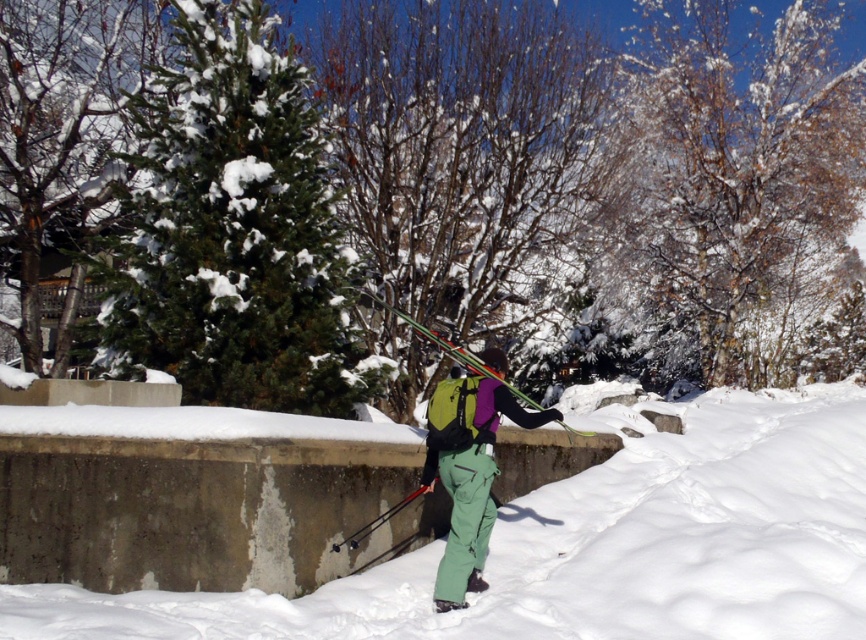
Between green matte tree at center and snow-covered branches at upper center, which one is positioned lower?

Positioned lower is green matte tree at center.

Does point (357, 99) lie behind point (703, 99)?

No, (357, 99) is closer to viewer.

The image size is (866, 640). Identify the location of green matte tree at center. (466, 157).

Who is lower down, white powdery snow at lower center or green evergreen tree at left?

white powdery snow at lower center is below.

Locate an element on the screen. Image resolution: width=866 pixels, height=640 pixels. white powdery snow at lower center is located at coordinates (590, 547).

Identify the location of white powdery snow at lower center. This screenshot has height=640, width=866. (590, 547).

Is snow-covered branches at upper center to the right of green evergreen tree at left from the viewer's perspective?

Correct, you'll find snow-covered branches at upper center to the right of green evergreen tree at left.

Can you confirm if snow-covered branches at upper center is bigger than green evergreen tree at left?

Indeed, snow-covered branches at upper center has a larger size compared to green evergreen tree at left.

Where is `snow-covered branches at upper center`? Image resolution: width=866 pixels, height=640 pixels. snow-covered branches at upper center is located at coordinates (732, 186).